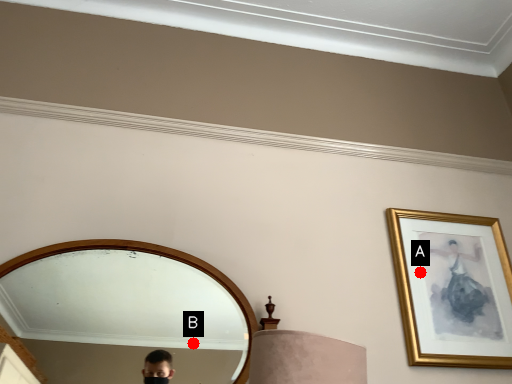
Question: Two points are circled on the image, labeled by A and B beside each circle. Which point appears farthest from the camera in this image?

Choices:
 (A) A is further
 (B) B is further

Answer: (A)